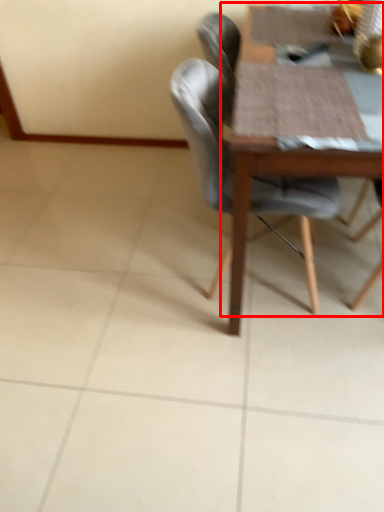
Question: From the image's perspective, where is round table (annotated by the red box) located relative to chair?

Choices:
 (A) above
 (B) below

Answer: (A)